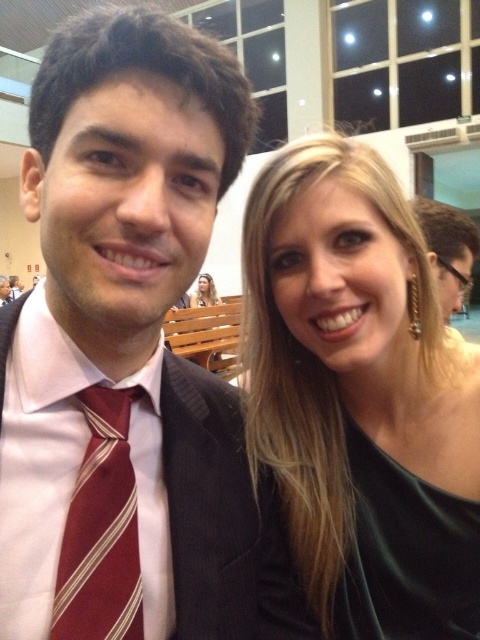
Question: Does maroon striped tie at center have a smaller size compared to matte black hair at upper right?

Choices:
 (A) no
 (B) yes

Answer: (B)

Question: Which of the following is the closest to the observer?

Choices:
 (A) (56, 572)
 (B) (84, 493)

Answer: (A)

Question: Can you confirm if matte black hair at upper right is wider than matte black hair at upper center?

Choices:
 (A) yes
 (B) no

Answer: (A)

Question: Among these objects, which one is nearest to the camera?

Choices:
 (A) matte black suit at left
 (B) matte black hair at upper center
 (C) matte black hair at upper right

Answer: (A)

Question: Which of these objects is positioned closest to the green satin dress at right?

Choices:
 (A) maroon striped tie at center
 (B) matte black suit at left
 (C) matte black hair at upper right

Answer: (B)

Question: Can you confirm if maroon striped tie at center is positioned to the right of matte black hair at upper center?

Choices:
 (A) yes
 (B) no

Answer: (A)